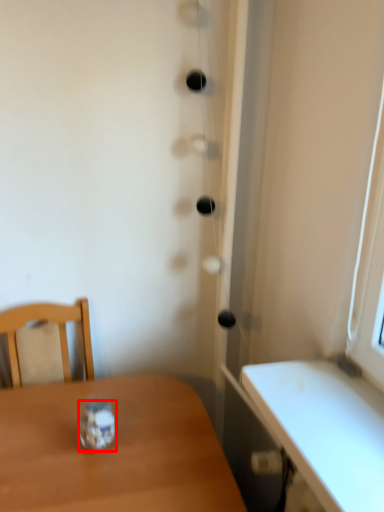
Question: From the image, what is the correct spatial relationship of glass jar (annotated by the red box) in relation to table?

Choices:
 (A) right
 (B) left

Answer: (B)